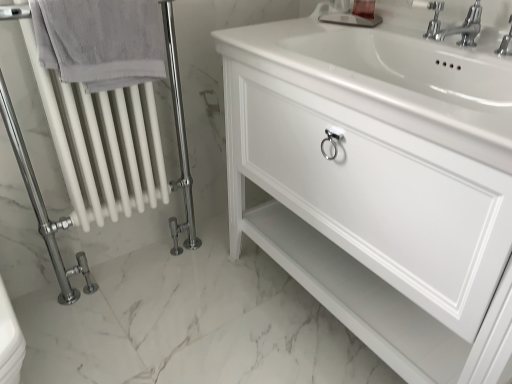
Locate an element on the screen. This screenshot has height=384, width=512. vacant space to the right of white glossy radiator at left is located at coordinates (210, 307).